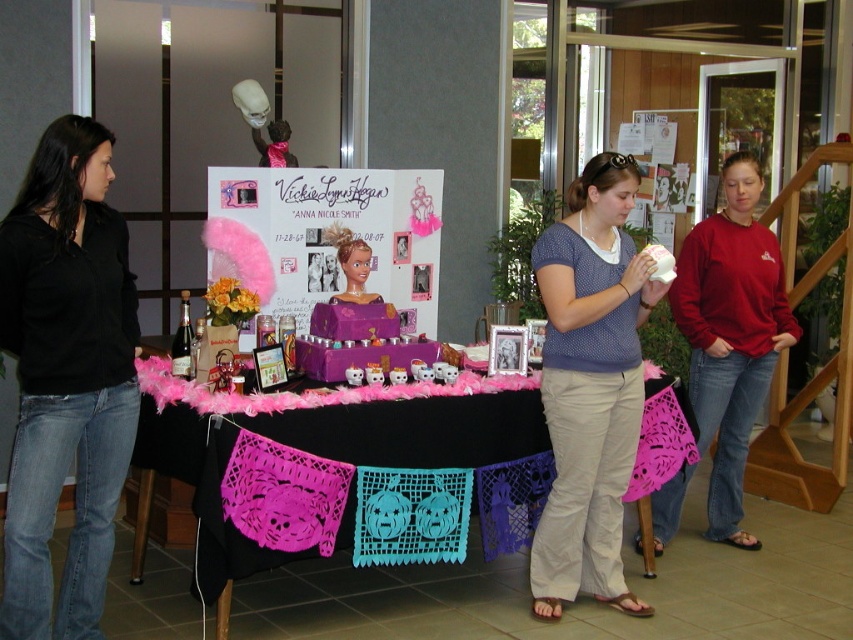
Who is taller, matte blue blouse at center or pink feather boa at center?

Standing taller between the two is matte blue blouse at center.

This screenshot has height=640, width=853. I want to click on matte blue blouse at center, so pyautogui.click(x=590, y=387).

The height and width of the screenshot is (640, 853). I want to click on matte blue blouse at center, so click(590, 387).

Which is above, pink feather boa at center or red cotton sweatshirt at center?

pink feather boa at center

Can you confirm if pink feather boa at center is wider than red cotton sweatshirt at center?

Yes, pink feather boa at center is wider than red cotton sweatshirt at center.

Measure the distance between point (257, 196) and camera.

A distance of 15.23 feet exists between point (257, 196) and camera.

Locate an element on the screen. The height and width of the screenshot is (640, 853). pink feather boa at center is located at coordinates (328, 237).

Is black denim jeans at left taller than red cotton sweatshirt at center?

No, black denim jeans at left is not taller than red cotton sweatshirt at center.

Where is `black denim jeans at left`? black denim jeans at left is located at coordinates (65, 376).